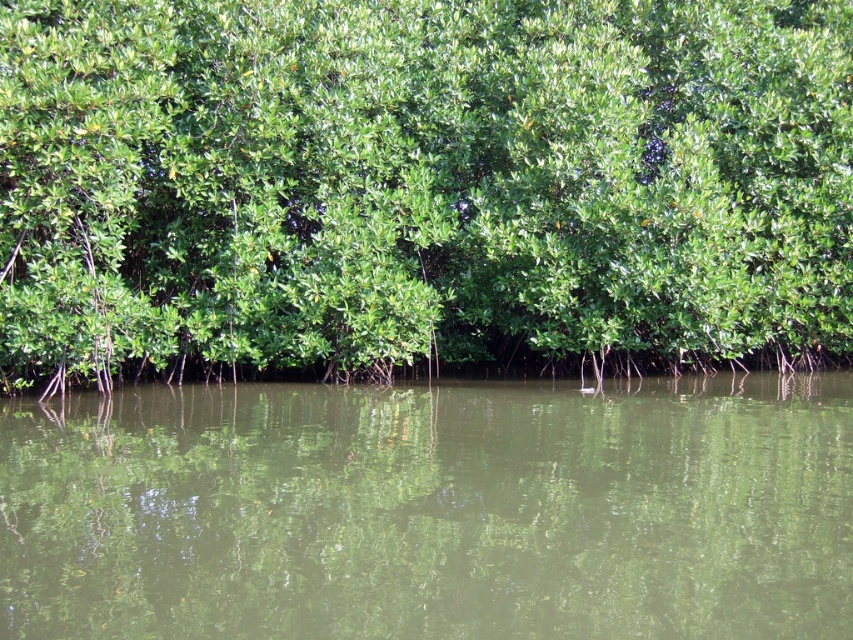
Based on the photo, you are standing on a wooden boardwalk observing the green leafy tree at center and the green reflective water at center in the mangrove scene. Which object is positioned to the right side?

The green leafy tree at center is positioned to the right of the green reflective water at center.

You are standing on a wooden boardwalk observing the green leafy tree at center and the green reflective water at center. Which object is closer to you?

The green leafy tree at center is closer to you than the green reflective water at center because it is positioned further to the viewer.

You are standing at the center of the mangrove area and want to locate the green leafy tree at center. Which direction should you look to find it?

Since the green leafy tree at center is located at point (421, 188), you should look towards the center of the mangrove area to find it.